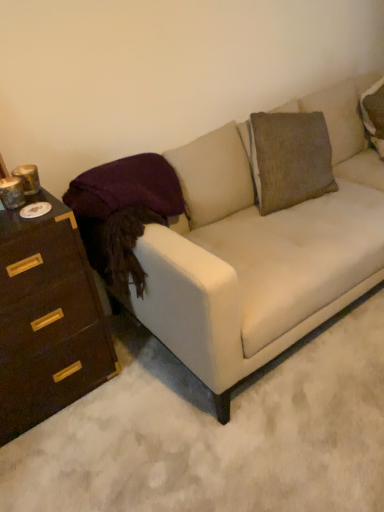
What do you see at coordinates (262, 245) in the screenshot? I see `white fabric couch at center` at bounding box center [262, 245].

Locate an element on the screen. white fabric couch at center is located at coordinates (262, 245).

Locate an element on the screen. The image size is (384, 512). dark brown wood chest of drawers at left is located at coordinates tap(47, 319).

What do you see at coordinates (47, 319) in the screenshot? The width and height of the screenshot is (384, 512). I see `dark brown wood chest of drawers at left` at bounding box center [47, 319].

You are a GUI agent. You are given a task and a screenshot of the screen. Output one action in this format:
    pyautogui.click(x=<x>, y=<y>)
    Task: Click on the white fabric couch at center
    This screenshot has height=512, width=384.
    Given the screenshot: What is the action you would take?
    pyautogui.click(x=262, y=245)

Visually, is dark brown wood chest of drawers at left positioned to the left or to the right of white fabric couch at center?

Clearly, dark brown wood chest of drawers at left is on the left of white fabric couch at center in the image.

Relative to white fabric couch at center, is dark brown wood chest of drawers at left in front or behind?

dark brown wood chest of drawers at left is positioned farther from the viewer than white fabric couch at center.

Which is farther from the camera, (15,320) or (252,357)?

The point (252,357) is farther.

From the image's perspective, is dark brown wood chest of drawers at left positioned above or below white fabric couch at center?

From the image's perspective, dark brown wood chest of drawers at left appears below white fabric couch at center.

From a real-world perspective, which is physically above, dark brown wood chest of drawers at left or white fabric couch at center?

white fabric couch at center.

Does dark brown wood chest of drawers at left have a lesser width compared to white fabric couch at center?

Yes, dark brown wood chest of drawers at left is thinner than white fabric couch at center.

Between dark brown wood chest of drawers at left and white fabric couch at center, which one has less height?

dark brown wood chest of drawers at left is shorter.

Looking at this image, is dark brown wood chest of drawers at left bigger or smaller than white fabric couch at center?

Clearly, dark brown wood chest of drawers at left is smaller in size than white fabric couch at center.

Does dark brown wood chest of drawers at left contain white fabric couch at center?

No, white fabric couch at center is located outside of dark brown wood chest of drawers at left.

From the picture: Is dark brown wood chest of drawers at left not near white fabric couch at center?

No, dark brown wood chest of drawers at left is not far away from white fabric couch at center.

Is dark brown wood chest of drawers at left facing away from white fabric couch at center?

dark brown wood chest of drawers at left does not have its back to white fabric couch at center.

I want to click on chest of drawers below the white fabric couch at center (from the image's perspective), so click(x=47, y=319).

Is white fabric couch at center at the left side of dark brown wood chest of drawers at left?

No.

Which object is more forward, white fabric couch at center or dark brown wood chest of drawers at left?

white fabric couch at center.

Between point (272, 333) and point (32, 288), which one is positioned behind?

The point (272, 333) is behind.

From the image's perspective, is white fabric couch at center above or below dark brown wood chest of drawers at left?

white fabric couch at center is situated higher than dark brown wood chest of drawers at left in the image.

Consider the image. From a real-world perspective, is white fabric couch at center physically above dark brown wood chest of drawers at left?

Yes, from a real-world perspective, white fabric couch at center is on top of dark brown wood chest of drawers at left.

Between white fabric couch at center and dark brown wood chest of drawers at left, which one has smaller width?

dark brown wood chest of drawers at left is thinner.

Is white fabric couch at center taller than dark brown wood chest of drawers at left?

Correct, white fabric couch at center is much taller as dark brown wood chest of drawers at left.

Based on the photo, looking at the image, does white fabric couch at center seem bigger or smaller compared to dark brown wood chest of drawers at left?

Clearly, white fabric couch at center is larger in size than dark brown wood chest of drawers at left.

Is dark brown wood chest of drawers at left completely or partially inside white fabric couch at center?

Definitely not — dark brown wood chest of drawers at left is not inside white fabric couch at center.

Based on the photo, are white fabric couch at center and dark brown wood chest of drawers at left far apart?

No.

Is white fabric couch at center facing towards dark brown wood chest of drawers at left?

No, white fabric couch at center is not turned towards dark brown wood chest of drawers at left.

How many degrees apart are the facing directions of white fabric couch at center and dark brown wood chest of drawers at left?

There is a 0.249-degree angle between the facing directions of white fabric couch at center and dark brown wood chest of drawers at left.

Locate an element on the screen. The height and width of the screenshot is (512, 384). studio couch located on the right of dark brown wood chest of drawers at left is located at coordinates (262, 245).

The height and width of the screenshot is (512, 384). Identify the location of studio couch above the dark brown wood chest of drawers at left (from the image's perspective). coord(262,245).

The image size is (384, 512). Identify the location of chest of drawers that is on the left side of white fabric couch at center. (47, 319).